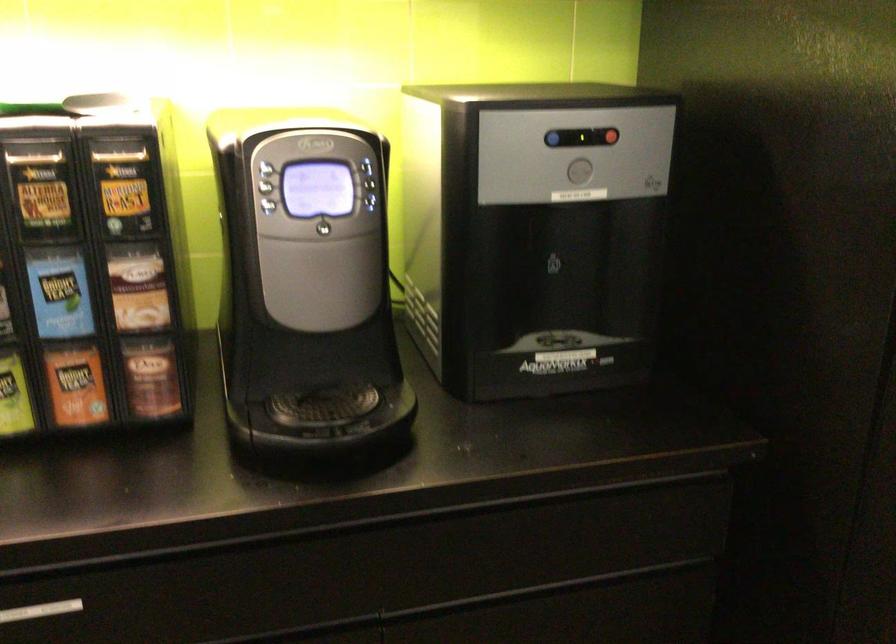
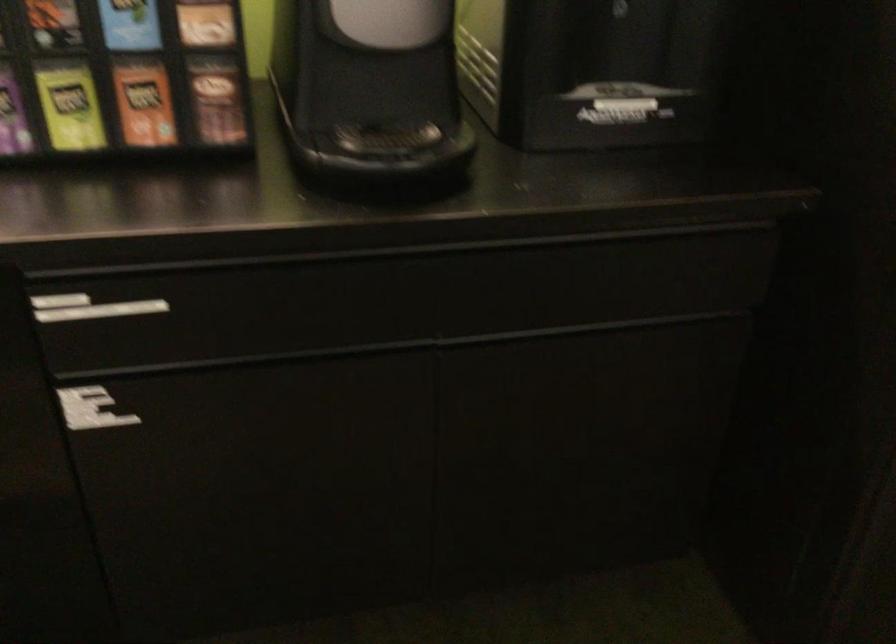
The images are taken continuously from a first-person perspective. In which direction are you moving?

The cameraman moved toward left, backward.